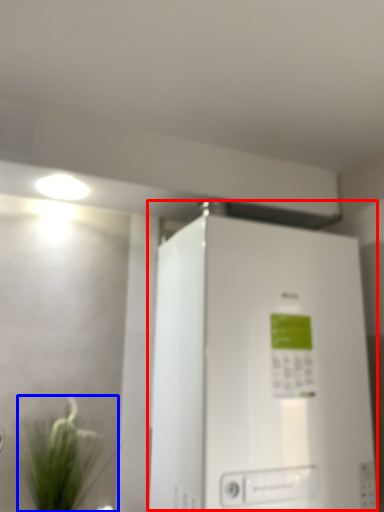
Question: Which point is further to the camera, refrigerator (highlighted by a red box) or houseplant (highlighted by a blue box)?

Choices:
 (A) refrigerator
 (B) houseplant

Answer: (B)